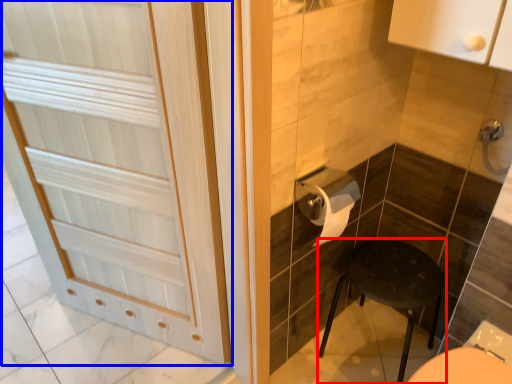
Question: Which object appears farthest to the camera in this image, furniture (highlighted by a red box) or door (highlighted by a blue box)?

Choices:
 (A) furniture
 (B) door

Answer: (A)